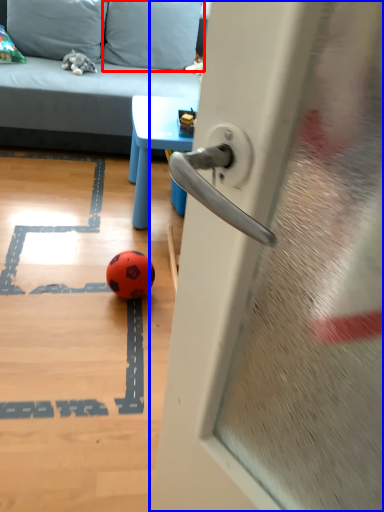
Question: Which object is closer to the camera taking this photo, pillow (highlighted by a red box) or door (highlighted by a blue box)?

Choices:
 (A) pillow
 (B) door

Answer: (B)